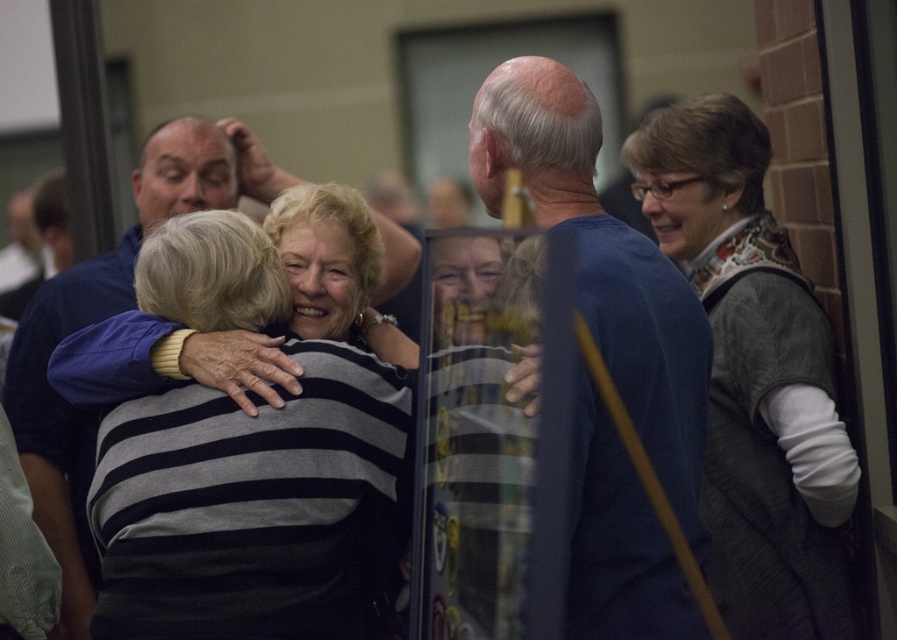
You are organizing a clothing donation drive and need to categorize items by size. You have two garments in front of you, the striped fabric sweater at center and the blue fabric shirt at center. Based on their sizes, which one should you place in the small size bin?

The striped fabric sweater at center has a smaller size compared to the blue fabric shirt at center, so it should be placed in the small size bin.

You are organizing a photo shoot and need to arrange the subjects so that the knitted gray vest at right and the blue fabric shirt at center are visible in the frame. Based on their positions in the image, which object should be placed higher to ensure both are visible?

The knitted gray vest at right is located below the blue fabric shirt at center, so to ensure both are visible in the frame, the knitted gray vest at right should be placed higher so that the blue fabric shirt at center can be positioned above it without blocking the view.